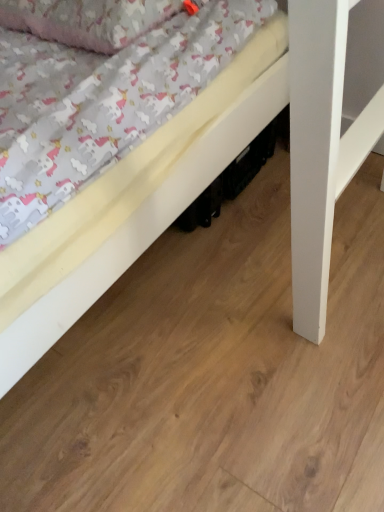
Find the location of a particular element. free space above white matte bed at lower left (from a real-world perspective) is located at coordinates (228, 309).